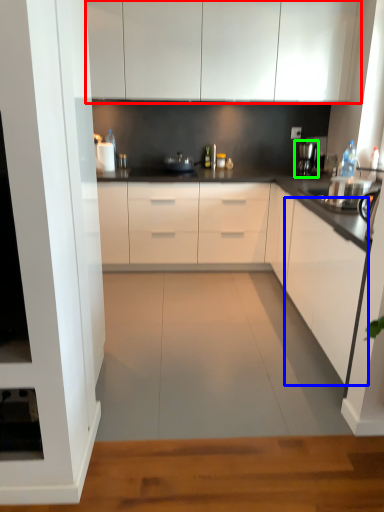
Question: Considering the real-world distances, which object is closest to cabinetry (highlighted by a red box)? cabinetry (highlighted by a blue box) or coffee machine (highlighted by a green box).

Choices:
 (A) cabinetry
 (B) coffee machine

Answer: (B)